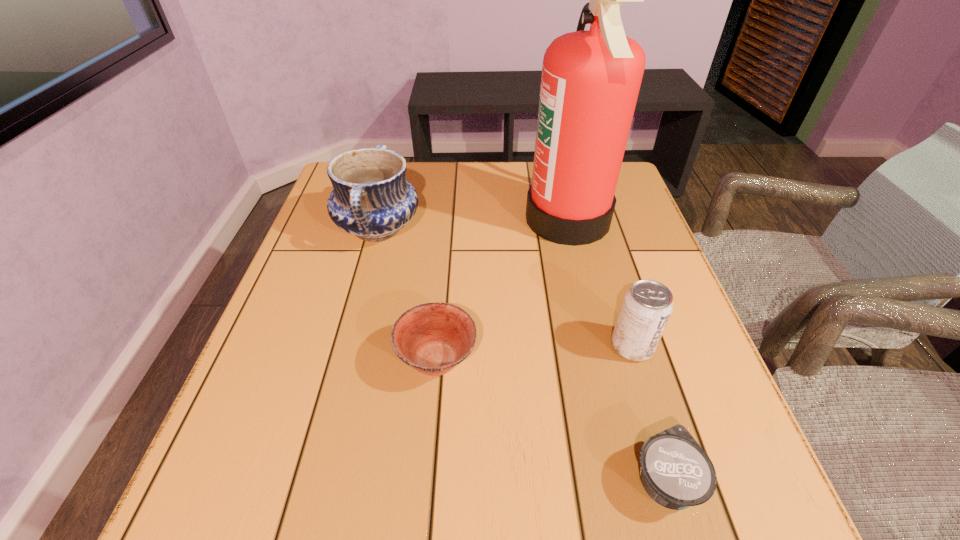
This screenshot has height=540, width=960. I want to click on free region located on the back of the soda can, so click(600, 240).

Identify the location of vacant space located 0.300m on the right of the second shortest object. (638, 360).

The image size is (960, 540). I want to click on free region located 0.180m on the left of the nearest object, so click(x=512, y=480).

Identify the location of fire extinguisher at the far edge. (590, 82).

Where is `pottery located at the far edge`? pottery located at the far edge is located at coordinates (371, 198).

Identify the location of object that is at the near edge. This screenshot has width=960, height=540. (675, 471).

At what (x,y) coordinates should I click in order to perform the action: click on object that is at the left edge. Please return your answer as a coordinate pair (x, y). Image resolution: width=960 pixels, height=540 pixels. Looking at the image, I should click on (371, 198).

Identify the location of fire extinguisher that is positioned at the right edge. (590, 82).

At what (x,y) coordinates should I click in order to perform the action: click on soda can that is at the right edge. Please return your answer as a coordinate pair (x, y). This screenshot has height=540, width=960. Looking at the image, I should click on (646, 308).

Identify the location of yogurt that is at the right edge. (675, 471).